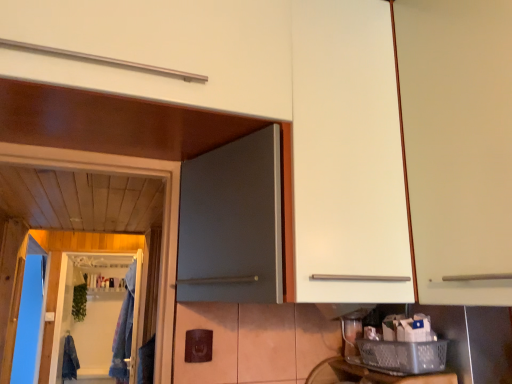
Question: Is metallic silver basket at lower right further to camera compared to denim jacket at lower left, which appears as the second laundry when viewed from the top?

Choices:
 (A) yes
 (B) no

Answer: (B)

Question: Can you confirm if metallic silver basket at lower right is positioned to the right of denim jacket at lower left, which ranks as the first laundry in left-to-right order?

Choices:
 (A) no
 (B) yes

Answer: (B)

Question: Can you confirm if metallic silver basket at lower right is shorter than denim jacket at lower left, which is counted as the second laundry, starting from the front?

Choices:
 (A) yes
 (B) no

Answer: (A)

Question: Is metallic silver basket at lower right positioned before denim jacket at lower left, positioned as the 2th laundry in right-to-left order?

Choices:
 (A) yes
 (B) no

Answer: (A)

Question: Can you confirm if metallic silver basket at lower right is smaller than denim jacket at lower left, which is counted as the first laundry, starting from the bottom?

Choices:
 (A) no
 (B) yes

Answer: (B)

Question: Can denim jacket at lower left, which is counted as the second laundry, starting from the front, be found inside metallic silver basket at lower right?

Choices:
 (A) yes
 (B) no

Answer: (B)

Question: From a real-world perspective, is clear plastic screen door at lower left on top of blue fabric laundry at left, which is the 1th laundry from front to back?

Choices:
 (A) no
 (B) yes

Answer: (B)

Question: From the image's perspective, is clear plastic screen door at lower left located above blue fabric laundry at left, positioned as the second laundry in back-to-front order?

Choices:
 (A) no
 (B) yes

Answer: (A)

Question: Would you say clear plastic screen door at lower left is outside blue fabric laundry at left, acting as the first laundry starting from the top?

Choices:
 (A) no
 (B) yes

Answer: (B)

Question: Can you confirm if clear plastic screen door at lower left is bigger than blue fabric laundry at left, acting as the first laundry starting from the top?

Choices:
 (A) yes
 (B) no

Answer: (B)

Question: Is clear plastic screen door at lower left taller than blue fabric laundry at left, which appears as the 1th laundry when viewed from the right?

Choices:
 (A) yes
 (B) no

Answer: (A)

Question: Can you confirm if clear plastic screen door at lower left is positioned to the left of blue fabric laundry at left, acting as the 2th laundry starting from the left?

Choices:
 (A) no
 (B) yes

Answer: (B)

Question: Does white matte cabinet at right have a lesser width compared to blue fabric laundry at left, which is the 1th laundry from front to back?

Choices:
 (A) no
 (B) yes

Answer: (B)